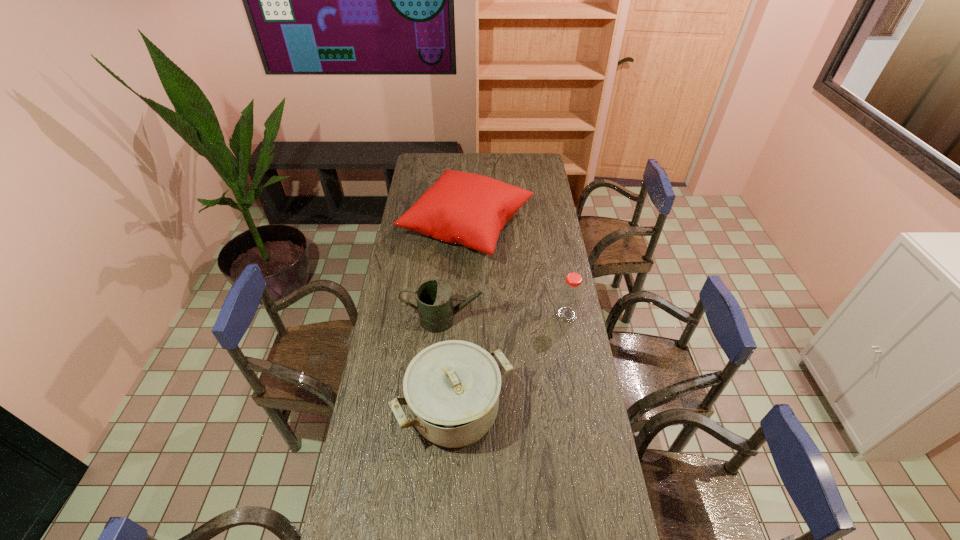
At what (x,y) coordinates should I click in order to perform the action: click on cushion. Please return your answer as a coordinate pair (x, y). This screenshot has height=540, width=960. Looking at the image, I should click on (469, 209).

Identify the location of bottle. (570, 296).

At what (x,y) coordinates should I click in order to perform the action: click on the nearest object. Please return your answer as a coordinate pair (x, y). The height and width of the screenshot is (540, 960). Looking at the image, I should click on (452, 388).

Where is `watering can`? This screenshot has width=960, height=540. watering can is located at coordinates pos(434,297).

Where is `vacant area located 0.220m on the front of the farthest object`? The image size is (960, 540). vacant area located 0.220m on the front of the farthest object is located at coordinates (464, 310).

The image size is (960, 540). Find the location of `vacant space situated 0.380m on the back of the bottle`. vacant space situated 0.380m on the back of the bottle is located at coordinates (554, 247).

Locate an element on the screen. vacant area situated 0.130m on the right of the nearest object is located at coordinates (550, 410).

You are a GUI agent. You are given a task and a screenshot of the screen. Output one action in this format:
    pyautogui.click(x=<x>, y=<y>)
    Task: Click on the vacant space located 0.330m with the spout on the watering can
    The image size is (960, 540).
    Given the screenshot: What is the action you would take?
    pyautogui.click(x=571, y=319)

Where is `cushion present at the left edge`? cushion present at the left edge is located at coordinates (469, 209).

Find the location of a particular element. The image size is (960, 540). saucepan located at the left edge is located at coordinates (452, 388).